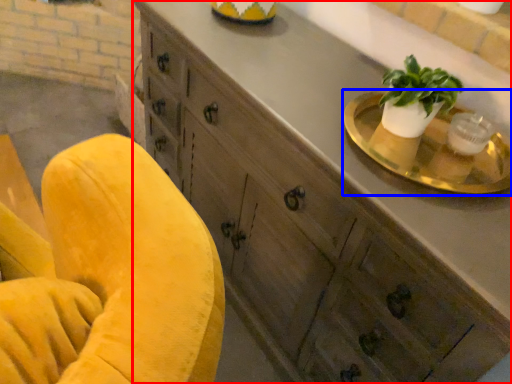
Question: Among these objects, which one is farthest to the camera, cabinetry (highlighted by a red box) or round table (highlighted by a blue box)?

Choices:
 (A) cabinetry
 (B) round table

Answer: (B)